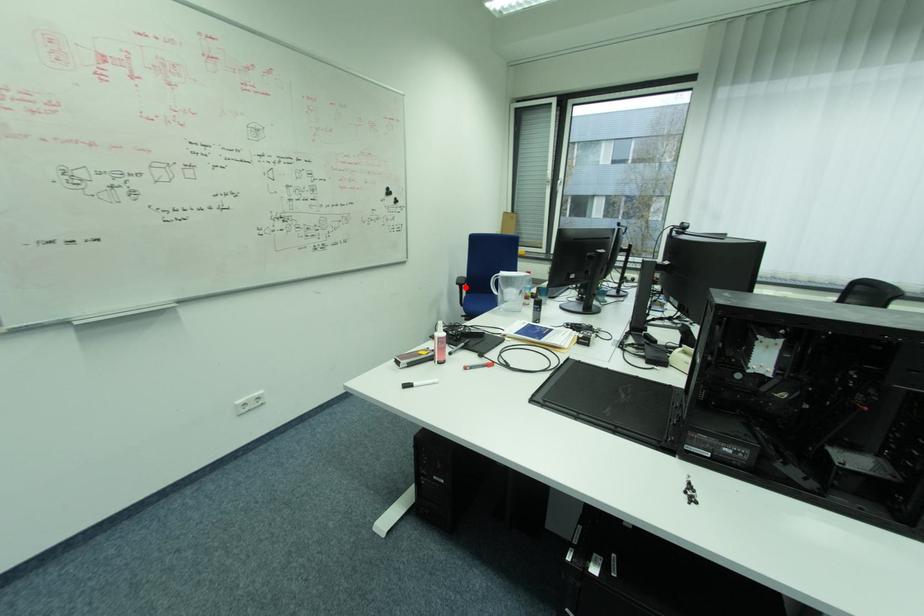
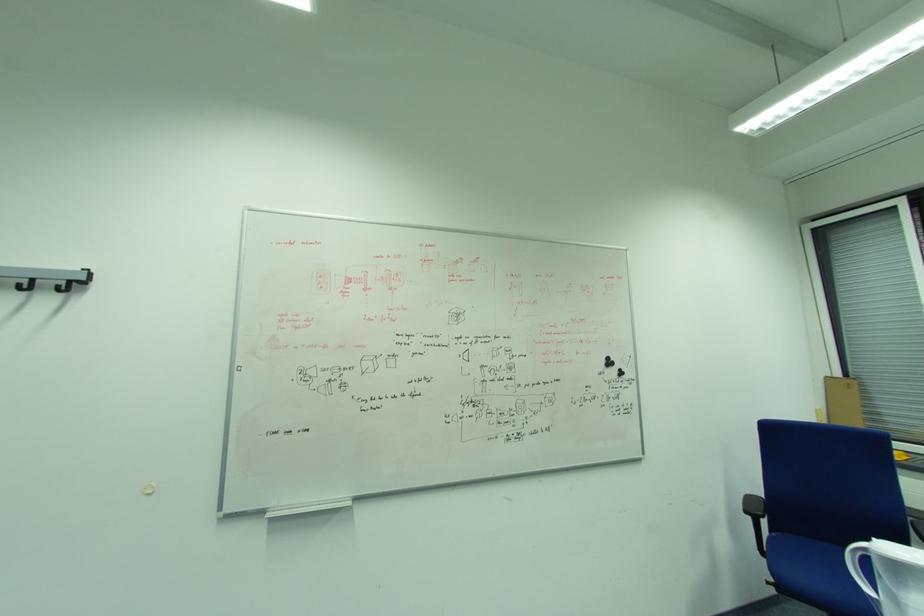
In the second image, find the point that corresponds to the highlighted location in the first image.

(757, 517)